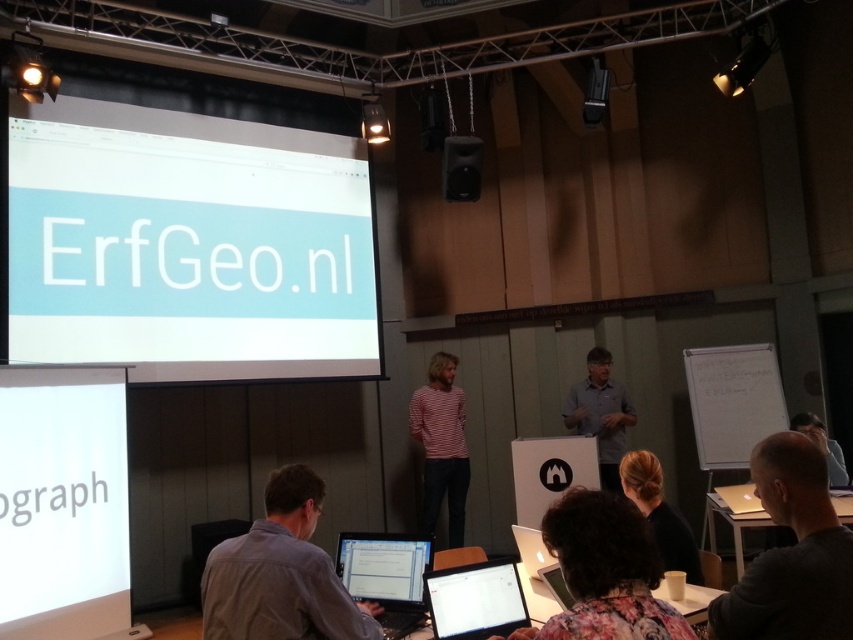
Question: Which point is closer to the camera?

Choices:
 (A) matte black laptop at lower center
 (B) gray shirt at lower center

Answer: (B)

Question: Is black plastic speaker at upper center below dark blue shirt at lower right?

Choices:
 (A) no
 (B) yes

Answer: (A)

Question: Does light blue matte projection screen at upper left have a smaller size compared to black glossy laptop at center?

Choices:
 (A) no
 (B) yes

Answer: (A)

Question: Does gray matte shirt at lower right lie behind gray shirt at lower center?

Choices:
 (A) yes
 (B) no

Answer: (B)

Question: Which point is closer to the camera?

Choices:
 (A) (383, 600)
 (B) (677, 522)
 (C) (804, 420)
 (D) (466, 586)

Answer: (D)

Question: Among these objects, which one is farthest from the camera?

Choices:
 (A) black glossy laptop at center
 (B) striped cotton shirt at center
 (C) matte black laptop at lower center

Answer: (B)